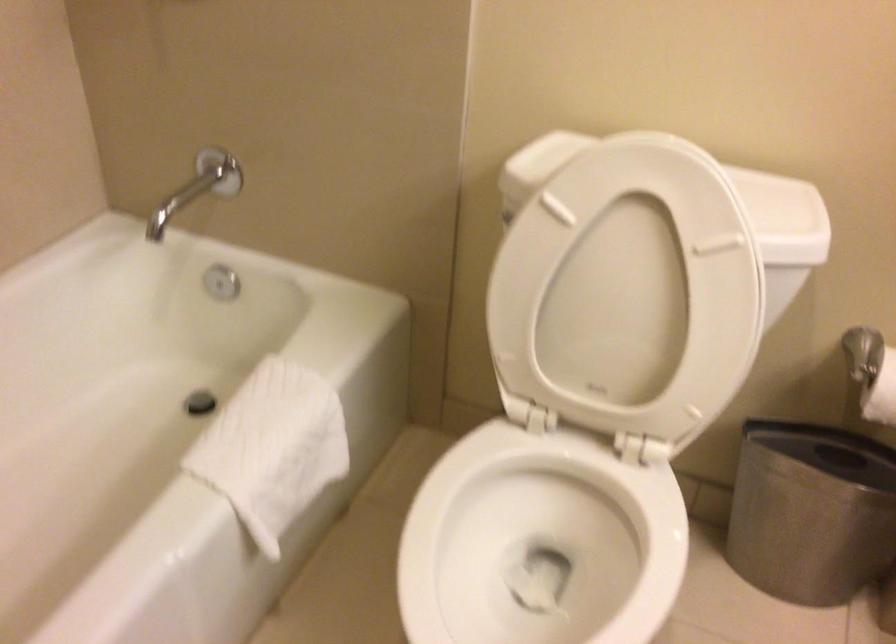
Find where to pull the metal tub spout. Please return your answer as a coordinate pair (x, y).

(168, 214)